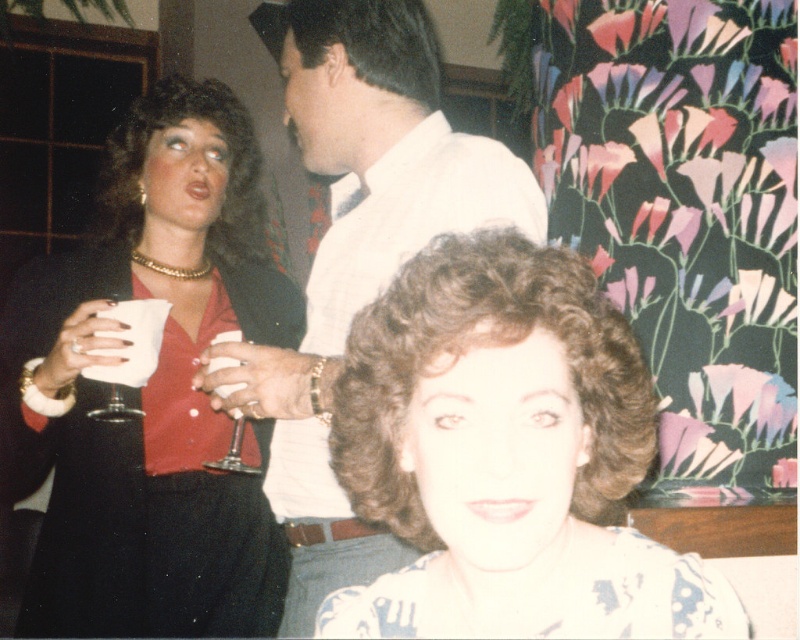
Question: Is floral print blouse at center wider than clear glass wine glass at center?

Choices:
 (A) yes
 (B) no

Answer: (A)

Question: Does matte black dress at upper left appear under white shirt at center?

Choices:
 (A) no
 (B) yes

Answer: (B)

Question: Which point is closer to the camera?

Choices:
 (A) clear glass wine glass at center
 (B) floral print blouse at center

Answer: (B)

Question: Does matte black dress at upper left appear over clear glass wine glass at left?

Choices:
 (A) yes
 (B) no

Answer: (A)

Question: Which object is positioned farthest from the white shirt at center?

Choices:
 (A) clear glass wine glass at left
 (B) matte black dress at upper left
 (C) floral print blouse at center
 (D) clear glass wine glass at center

Answer: (C)

Question: Which object is positioned farthest from the matte black dress at upper left?

Choices:
 (A) clear glass wine glass at center
 (B) floral print blouse at center

Answer: (B)